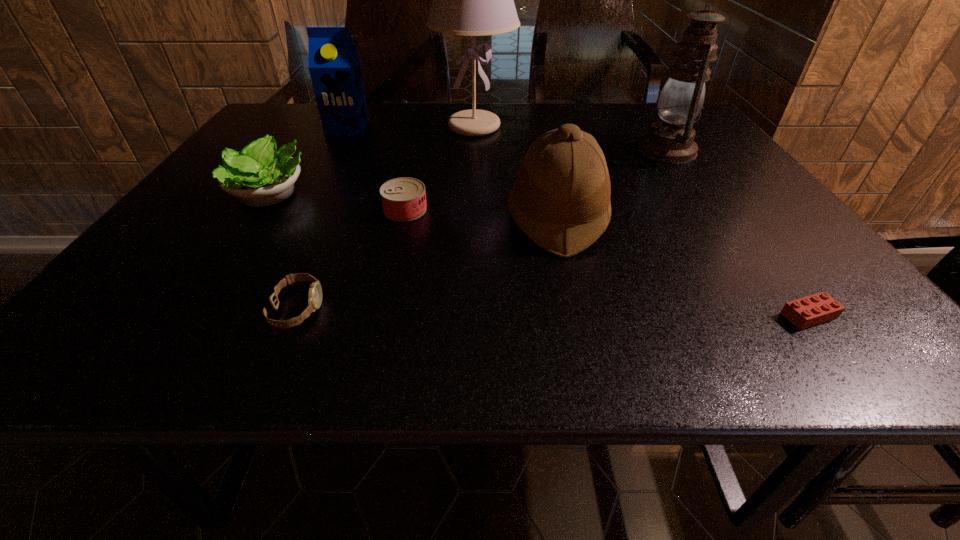
At what (x,y) coordinates should I click in order to perform the action: click on the tallest object. Please return your answer as a coordinate pair (x, y). Looking at the image, I should click on (472, 0).

In order to click on the second tallest object in this screenshot , I will do `click(671, 141)`.

This screenshot has height=540, width=960. In order to click on the sixth shortest object in this screenshot , I will do `click(333, 62)`.

You are a GUI agent. You are given a task and a screenshot of the screen. Output one action in this format:
    pyautogui.click(x=<x>, y=<y>)
    Task: Click on the hat
    The width and height of the screenshot is (960, 540).
    Given the screenshot: What is the action you would take?
    pyautogui.click(x=561, y=196)

This screenshot has width=960, height=540. In order to click on the fourth shortest object in this screenshot , I will do `click(259, 175)`.

The image size is (960, 540). Identify the location of can. (403, 199).

Where is `watch`? This screenshot has height=540, width=960. watch is located at coordinates (315, 291).

The image size is (960, 540). I want to click on Lego, so click(x=812, y=310).

Where is `free space located on the right of the lampshade`? The height and width of the screenshot is (540, 960). free space located on the right of the lampshade is located at coordinates (583, 126).

Where is `vacant area situated 0.060m on the front of the second tallest object`? vacant area situated 0.060m on the front of the second tallest object is located at coordinates click(686, 180).